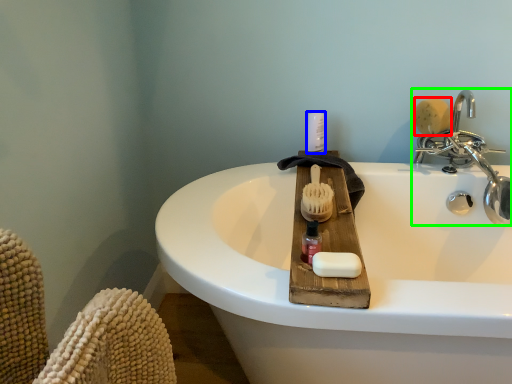
Question: Based on their relative distances, which object is nearer to brush (highlighted by a red box)? Choose from toiletry (highlighted by a blue box) and tap (highlighted by a green box).

Choices:
 (A) toiletry
 (B) tap

Answer: (B)